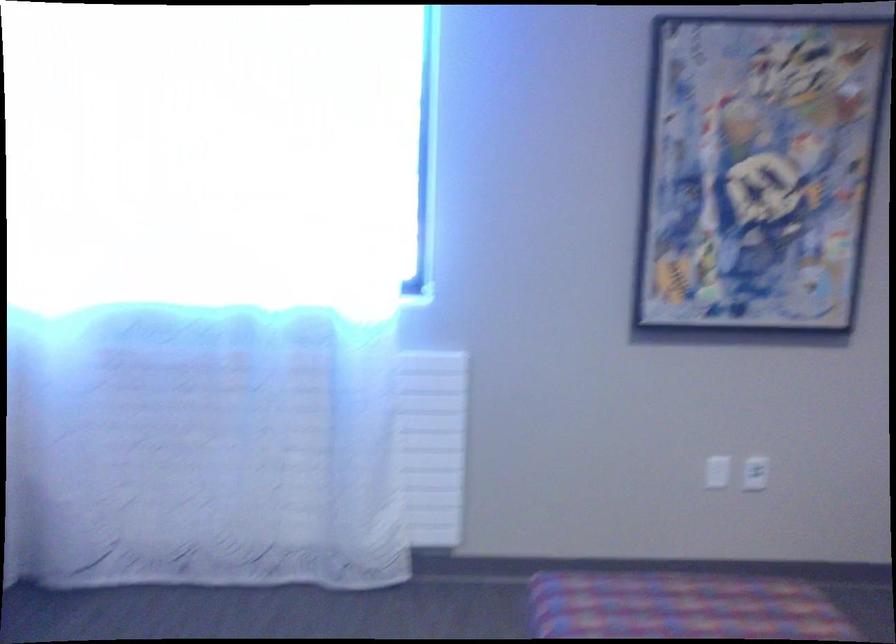
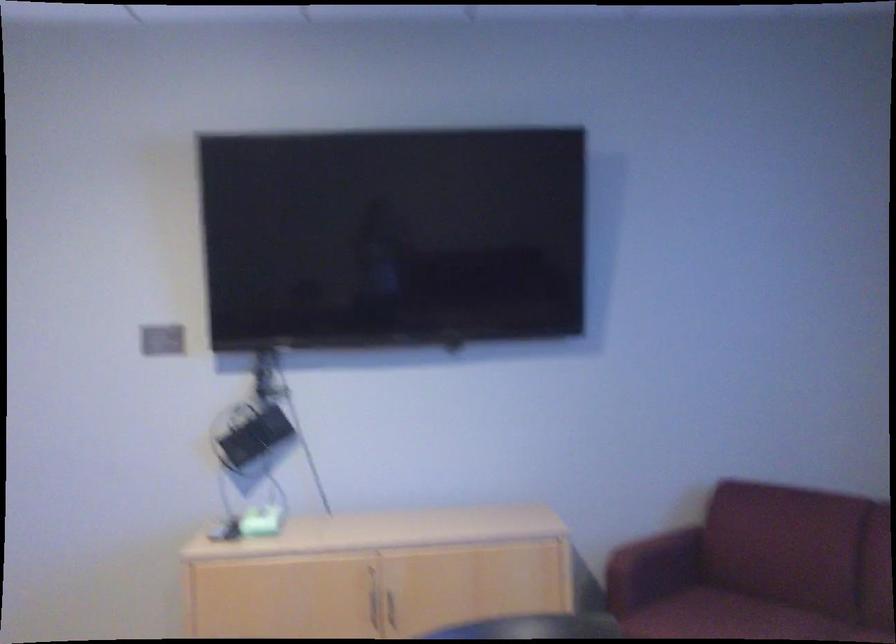
Question: Based on the continuous images, in which direction is the camera rotating? Reply with the corresponding letter.

Choices:
 (A) Left
 (B) Right
 (C) Up
 (D) Down

Answer: (A)